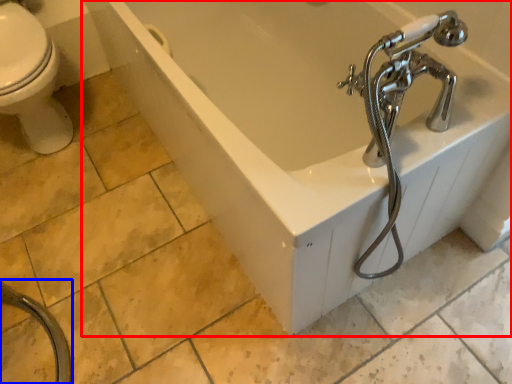
Question: Which object appears closest to the camera in this image, bathtub (highlighted by a red box) or garden hose (highlighted by a blue box)?

Choices:
 (A) bathtub
 (B) garden hose

Answer: (B)